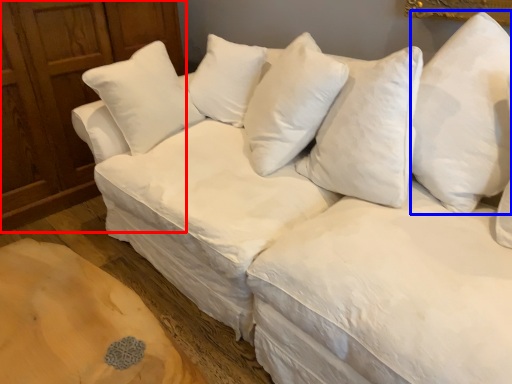
Question: Which object is closer to the camera taking this photo, dresser (highlighted by a red box) or pillow (highlighted by a blue box)?

Choices:
 (A) dresser
 (B) pillow

Answer: (B)